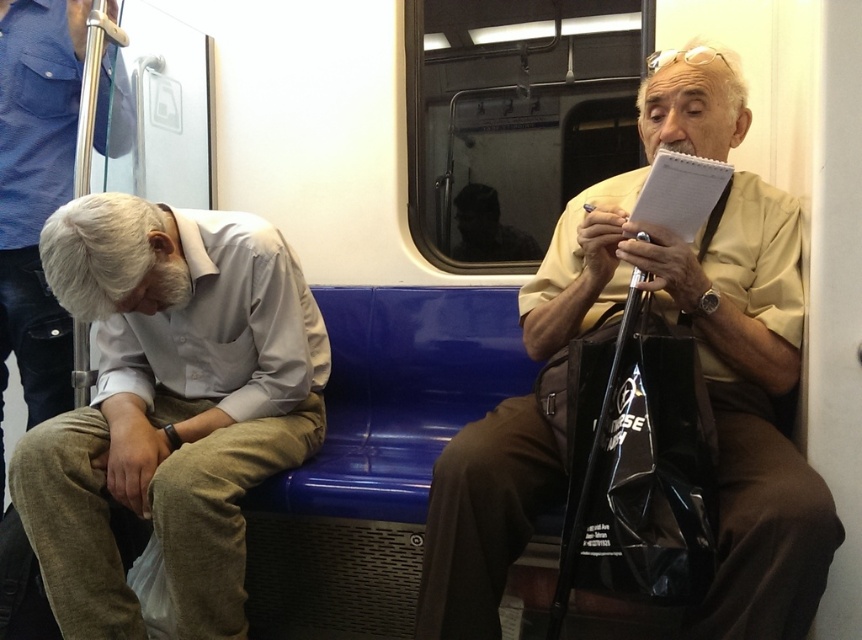
Question: Can you confirm if light gray cotton shirt at lower left is positioned above yellow matte shirt at upper right?

Choices:
 (A) no
 (B) yes

Answer: (A)

Question: Is yellow matte shirt at upper right to the left of gray cotton shirt at left from the viewer's perspective?

Choices:
 (A) no
 (B) yes

Answer: (A)

Question: Which point is closer to the camera?

Choices:
 (A) (47, 97)
 (B) (716, 230)

Answer: (B)

Question: Which of the following is the farthest from the observer?

Choices:
 (A) (229, 371)
 (B) (50, 131)
 (C) (740, 284)

Answer: (B)

Question: Is light gray cotton shirt at lower left thinner than yellow matte shirt at upper right?

Choices:
 (A) no
 (B) yes

Answer: (B)

Question: Which object is farther from the camera taking this photo?

Choices:
 (A) yellow matte shirt at upper right
 (B) light gray cotton shirt at lower left
 (C) gray cotton shirt at left

Answer: (C)